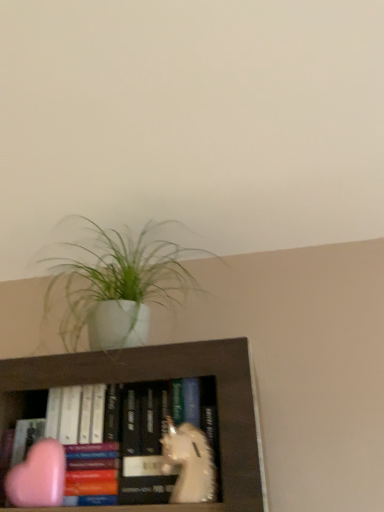
This screenshot has height=512, width=384. Describe the element at coordinates (116, 284) in the screenshot. I see `white matte pot at upper center` at that location.

This screenshot has height=512, width=384. What do you see at coordinates (189, 463) in the screenshot?
I see `white matte unicorn at center, placed as the 1th animal when sorted from right to left` at bounding box center [189, 463].

I want to click on pink matte heart at lower left, positioned as the 1th animal in left-to-right order, so click(38, 476).

In the image, is pink matte heart at lower left, which is the second animal from right to left, positioned in front of or behind white matte pot at upper center?

In the image, pink matte heart at lower left, which is the second animal from right to left, appears in front of white matte pot at upper center.

Is pink matte heart at lower left, positioned as the 1th animal in left-to-right order, to the left or to the right of white matte pot at upper center in the image?

Based on their positions, pink matte heart at lower left, positioned as the 1th animal in left-to-right order, is located to the left of white matte pot at upper center.

Considering the positions of point (52, 465) and point (66, 248), is point (52, 465) closer or farther from the camera than point (66, 248)?

Point (52, 465).

How many degrees apart are the facing directions of pink matte heart at lower left, which is the second animal from right to left, and white matte pot at upper center?

The facing directions of pink matte heart at lower left, which is the second animal from right to left, and white matte pot at upper center are 3.62 degrees apart.

Who is smaller, pink matte heart at lower left, positioned as the 1th animal in left-to-right order, or white matte unicorn at center, placed as the 1th animal when sorted from right to left?

pink matte heart at lower left, positioned as the 1th animal in left-to-right order.

Which object is wider, pink matte heart at lower left, positioned as the 1th animal in left-to-right order, or white matte unicorn at center, the second animal viewed from the left?

With larger width is white matte unicorn at center, the second animal viewed from the left.

Is pink matte heart at lower left, which is the second animal from right to left, oriented away from white matte unicorn at center, the second animal viewed from the left?

pink matte heart at lower left, which is the second animal from right to left, is not turned away from white matte unicorn at center, the second animal viewed from the left.

Which is correct: pink matte heart at lower left, which is the second animal from right to left, is inside white matte unicorn at center, placed as the 1th animal when sorted from right to left, or outside of it?

pink matte heart at lower left, which is the second animal from right to left, is outside white matte unicorn at center, placed as the 1th animal when sorted from right to left.

From a real-world perspective, which is physically above, white matte unicorn at center, placed as the 1th animal when sorted from right to left, or white matte pot at upper center?

white matte pot at upper center is physically above.

From the image's perspective, count 1st animals downward from the white matte pot at upper center and point to it. Please provide its 2D coordinates.

[(189, 463)]

Would you consider white matte unicorn at center, placed as the 1th animal when sorted from right to left, to be distant from white matte pot at upper center?

That's not correct — white matte unicorn at center, placed as the 1th animal when sorted from right to left, is a little close to white matte pot at upper center.

From the image's perspective, which object appears higher, white matte pot at upper center or pink matte heart at lower left, which is the second animal from right to left?

white matte pot at upper center is shown above in the image.

Is white matte pot at upper center located outside pink matte heart at lower left, positioned as the 1th animal in left-to-right order?

white matte pot at upper center is positioned outside pink matte heart at lower left, positioned as the 1th animal in left-to-right order.

Based on their sizes in the image, would you say white matte pot at upper center is bigger or smaller than pink matte heart at lower left, which is the second animal from right to left?

In the image, white matte pot at upper center appears to be larger than pink matte heart at lower left, which is the second animal from right to left.

Does point (138, 266) come in front of point (33, 492)?

No, (138, 266) is further to viewer.

Is white matte pot at upper center completely or partially outside of white matte unicorn at center, placed as the 1th animal when sorted from right to left?

That's correct, white matte pot at upper center is outside of white matte unicorn at center, placed as the 1th animal when sorted from right to left.

From a real-world perspective, starting from the white matte pot at upper center, which animal is the 1st one below it? Please provide its 2D coordinates.

[(189, 463)]

Does white matte pot at upper center have a greater width compared to white matte unicorn at center, the second animal viewed from the left?

Correct, the width of white matte pot at upper center exceeds that of white matte unicorn at center, the second animal viewed from the left.

Which of these two, white matte unicorn at center, placed as the 1th animal when sorted from right to left, or pink matte heart at lower left, positioned as the 1th animal in left-to-right order, is thinner?

pink matte heart at lower left, positioned as the 1th animal in left-to-right order, is thinner.

Is white matte unicorn at center, placed as the 1th animal when sorted from right to left, positioned far away from pink matte heart at lower left, positioned as the 1th animal in left-to-right order?

No, there isn't a large distance between white matte unicorn at center, placed as the 1th animal when sorted from right to left, and pink matte heart at lower left, positioned as the 1th animal in left-to-right order.

Which object is further away from the camera, white matte unicorn at center, the second animal viewed from the left, or pink matte heart at lower left, which is the second animal from right to left?

pink matte heart at lower left, which is the second animal from right to left, is further from the camera.

Does point (167, 462) lie behind point (16, 493)?

Yes, point (167, 462) is farther from viewer.

Locate an element on the screen. This screenshot has height=512, width=384. houseplant above the pink matte heart at lower left, positioned as the 1th animal in left-to-right order (from a real-world perspective) is located at coordinates (116, 284).

The image size is (384, 512). I want to click on animal below the white matte unicorn at center, the second animal viewed from the left (from the image's perspective), so point(38,476).

Estimate the real-world distances between objects in this image. Which object is closer to white matte unicorn at center, placed as the 1th animal when sorted from right to left, pink matte heart at lower left, positioned as the 1th animal in left-to-right order, or white matte pot at upper center?

Based on the image, pink matte heart at lower left, positioned as the 1th animal in left-to-right order, appears to be nearer to white matte unicorn at center, placed as the 1th animal when sorted from right to left.

Looking at the image, which one is located further to pink matte heart at lower left, positioned as the 1th animal in left-to-right order, white matte pot at upper center or white matte unicorn at center, the second animal viewed from the left?

Based on the image, white matte pot at upper center appears to be further to pink matte heart at lower left, positioned as the 1th animal in left-to-right order.

When comparing their distances from white matte pot at upper center, does white matte unicorn at center, the second animal viewed from the left, or pink matte heart at lower left, positioned as the 1th animal in left-to-right order, seem further?

white matte unicorn at center, the second animal viewed from the left, lies further to white matte pot at upper center than the other object.

Estimate the real-world distances between objects in this image. Which object is closer to white matte unicorn at center, the second animal viewed from the left, white matte pot at upper center or pink matte heart at lower left, which is the second animal from right to left?

pink matte heart at lower left, which is the second animal from right to left, is closer to white matte unicorn at center, the second animal viewed from the left.

When comparing their distances from white matte pot at upper center, does pink matte heart at lower left, positioned as the 1th animal in left-to-right order, or white matte unicorn at center, placed as the 1th animal when sorted from right to left, seem closer?

The object closer to white matte pot at upper center is pink matte heart at lower left, positioned as the 1th animal in left-to-right order.

From the image, which object appears to be nearer to pink matte heart at lower left, positioned as the 1th animal in left-to-right order, white matte unicorn at center, placed as the 1th animal when sorted from right to left, or white matte pot at upper center?

white matte unicorn at center, placed as the 1th animal when sorted from right to left, lies closer to pink matte heart at lower left, positioned as the 1th animal in left-to-right order, than the other object.

Where is `animal between white matte pot at upper center and pink matte heart at lower left, which is the second animal from right to left, in the up-down direction`? The image size is (384, 512). animal between white matte pot at upper center and pink matte heart at lower left, which is the second animal from right to left, in the up-down direction is located at coordinates (189, 463).